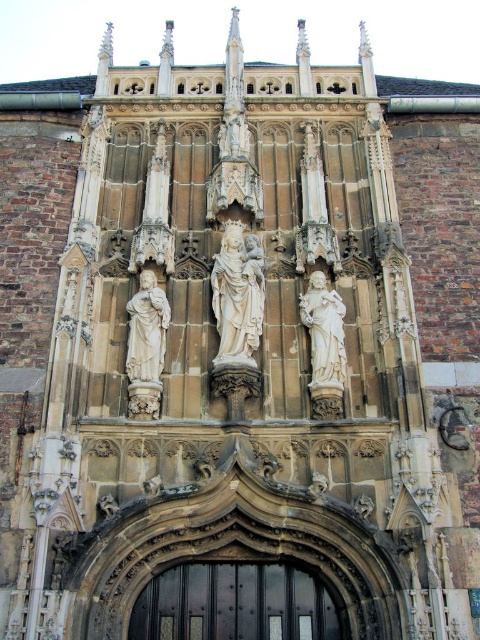
Which is behind, point (184, 595) or point (336, 296)?

The point (336, 296) is behind.

How far apart are black wood door at center and white marble statue at center?

They are 17.12 meters apart.

You are a GUI agent. You are given a task and a screenshot of the screen. Output one action in this format:
    pyautogui.click(x=<x>, y=<y>)
    Task: Click on the black wood door at center
    The width and height of the screenshot is (480, 640).
    Given the screenshot: What is the action you would take?
    pyautogui.click(x=233, y=604)

Locate an element on the screen. This screenshot has height=640, width=480. black wood door at center is located at coordinates (233, 604).

In the scene shown: Is black wood door at center positioned in front of white stone statue at center?

Yes, black wood door at center is in front of white stone statue at center.

Between black wood door at center and white stone statue at center, which one is positioned higher?

white stone statue at center is above.

You are a GUI agent. You are given a task and a screenshot of the screen. Output one action in this format:
    pyautogui.click(x=<x>, y=<y>)
    Task: Click on the black wood door at center
    
    Given the screenshot: What is the action you would take?
    pyautogui.click(x=233, y=604)

Who is positioned more to the right, white stone statue at center or white marble statue at center?

Positioned to the right is white marble statue at center.

Based on the photo, can you confirm if white stone statue at center is smaller than white marble statue at center?

No, white stone statue at center is not smaller than white marble statue at center.

At what (x,y) coordinates should I click in order to perform the action: click on white stone statue at center. Please return your answer as a coordinate pair (x, y). Image resolution: width=480 pixels, height=640 pixels. Looking at the image, I should click on (238, 294).